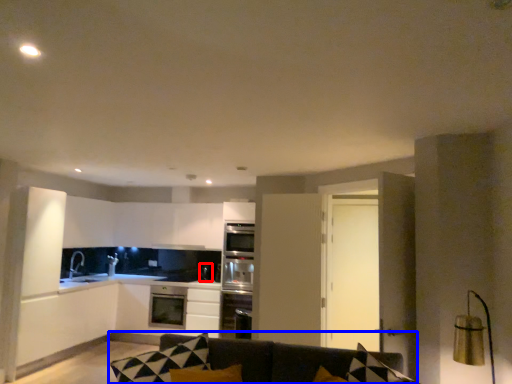
Question: Which object appears closest to the camera in this image, appliance (highlighted by a red box) or studio couch (highlighted by a blue box)?

Choices:
 (A) appliance
 (B) studio couch

Answer: (B)